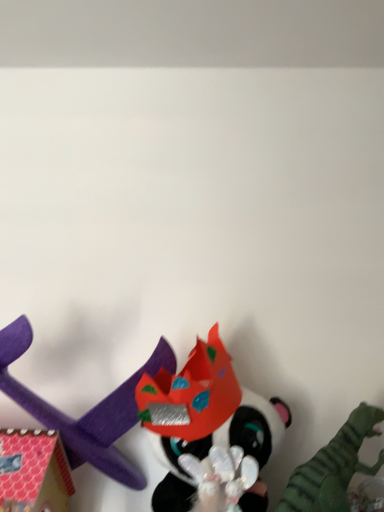
Question: Is shiny red paper crown at center, which ranks as the 2th toy in left-to-right order, facing away from purple foam airplane at lower left, which appears as the 1th toy when viewed from the left?

Choices:
 (A) no
 (B) yes

Answer: (A)

Question: Is shiny red paper crown at center, acting as the 2th toy starting from the right, touching purple foam airplane at lower left, which appears as the 1th toy when viewed from the left?

Choices:
 (A) yes
 (B) no

Answer: (B)

Question: Considering the relative sizes of shiny red paper crown at center, acting as the 2th toy starting from the right, and purple foam airplane at lower left, which appears as the 1th toy when viewed from the left, in the image provided, is shiny red paper crown at center, acting as the 2th toy starting from the right, smaller than purple foam airplane at lower left, which appears as the 1th toy when viewed from the left,?

Choices:
 (A) no
 (B) yes

Answer: (B)

Question: Does shiny red paper crown at center, acting as the 2th toy starting from the right, lie in front of purple foam airplane at lower left, which appears as the 1th toy when viewed from the left?

Choices:
 (A) no
 (B) yes

Answer: (A)

Question: Does shiny red paper crown at center, which ranks as the 2th toy in left-to-right order, turn towards purple foam airplane at lower left, which appears as the 1th toy when viewed from the left?

Choices:
 (A) no
 (B) yes

Answer: (A)

Question: Is shiny red paper crown at center, which ranks as the 2th toy in left-to-right order, inside or outside of purple foam airplane at lower left, which appears as the 1th toy when viewed from the left?

Choices:
 (A) inside
 (B) outside

Answer: (B)

Question: From the image's perspective, is shiny red paper crown at center, which ranks as the 2th toy in left-to-right order, located above or below purple foam airplane at lower left, which appears as the 1th toy when viewed from the left?

Choices:
 (A) above
 (B) below

Answer: (B)

Question: Is shiny red paper crown at center, which ranks as the 2th toy in left-to-right order, taller or shorter than purple foam airplane at lower left, which appears as the 1th toy when viewed from the left?

Choices:
 (A) short
 (B) tall

Answer: (B)

Question: From a real-world perspective, relative to purple foam airplane at lower left, the third toy positioned from the right, is shiny red paper crown at center, which ranks as the 2th toy in left-to-right order, vertically above or below?

Choices:
 (A) above
 (B) below

Answer: (B)

Question: Is shiny red paper crown at center, acting as the 2th toy starting from the right, inside the boundaries of shiny plastic mask at center, the 3th toy viewed from the left, or outside?

Choices:
 (A) inside
 (B) outside

Answer: (A)

Question: Is shiny red paper crown at center, acting as the 2th toy starting from the right, wider or thinner than shiny plastic mask at center, the 3th toy viewed from the left?

Choices:
 (A) wide
 (B) thin

Answer: (B)

Question: In terms of height, does shiny red paper crown at center, which ranks as the 2th toy in left-to-right order, look taller or shorter compared to shiny plastic mask at center, the 3th toy viewed from the left?

Choices:
 (A) tall
 (B) short

Answer: (A)

Question: From a real-world perspective, relative to shiny plastic mask at center, the 3th toy viewed from the left, is shiny red paper crown at center, acting as the 2th toy starting from the right, vertically above or below?

Choices:
 (A) below
 (B) above

Answer: (B)

Question: Visually, is purple foam airplane at lower left, which appears as the 1th toy when viewed from the left, positioned to the left or to the right of shiny plastic mask at center, the 3th toy viewed from the left?

Choices:
 (A) left
 (B) right

Answer: (A)

Question: Is purple foam airplane at lower left, which appears as the 1th toy when viewed from the left, spatially inside shiny plastic mask at center, the first toy in the right-to-left sequence, or outside of it?

Choices:
 (A) inside
 (B) outside

Answer: (B)